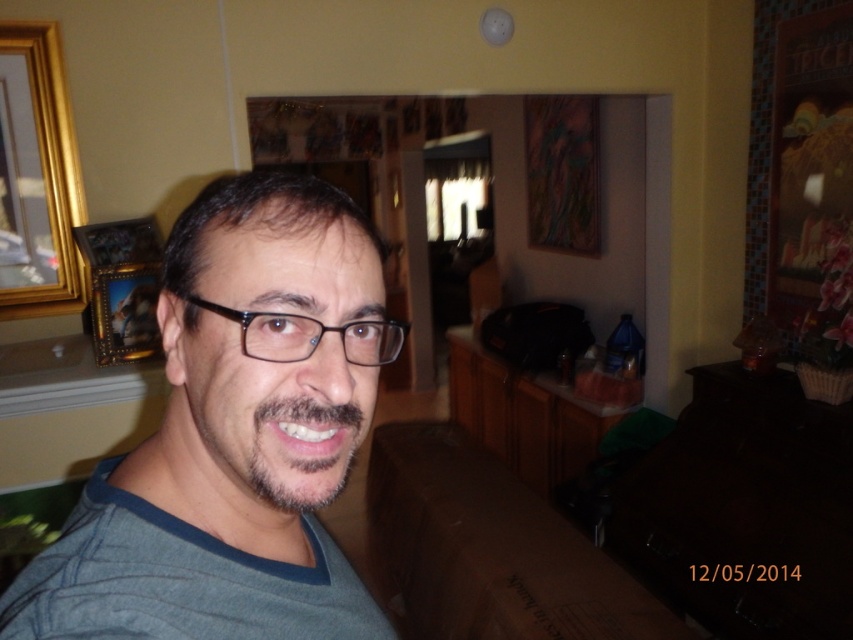
Can you confirm if gray matte shirt at center is shorter than graybeard at center?

No, gray matte shirt at center is not shorter than graybeard at center.

Is gray matte shirt at center further to camera compared to graybeard at center?

That is False.

Who is more forward, [302,237] or [341,467]?

Point [302,237]

Find the location of a particular element. gray matte shirt at center is located at coordinates (234, 436).

Does point (109, 508) come behind point (12, 289)?

No, (109, 508) is closer to viewer.

The height and width of the screenshot is (640, 853). Find the location of `gray cotton shirt at center`. gray cotton shirt at center is located at coordinates (178, 580).

This screenshot has width=853, height=640. I want to click on gray cotton shirt at center, so click(x=178, y=580).

Is the position of gray cotton shirt at center less distant than that of gold metallic picture frame at upper left?

Yes, it is in front of gold metallic picture frame at upper left.

This screenshot has width=853, height=640. I want to click on gray cotton shirt at center, so click(x=178, y=580).

Where is `gray cotton shirt at center`? gray cotton shirt at center is located at coordinates (178, 580).